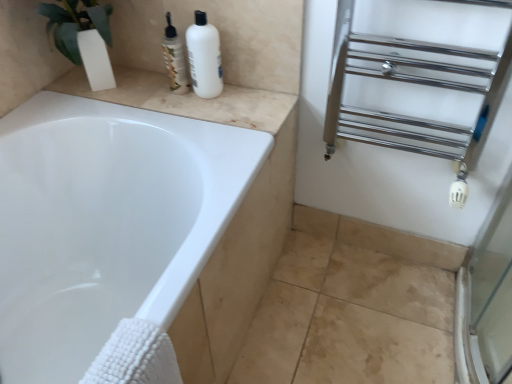
Question: Considering the relative positions of chrome/metal towel rack at right and beige marble counter top at upper left in the image provided, is chrome/metal towel rack at right behind beige marble counter top at upper left?

Choices:
 (A) yes
 (B) no

Answer: (B)

Question: Can we say chrome/metal towel rack at right lies outside beige marble counter top at upper left?

Choices:
 (A) no
 (B) yes

Answer: (B)

Question: From the image's perspective, is chrome/metal towel rack at right located above beige marble counter top at upper left?

Choices:
 (A) yes
 (B) no

Answer: (B)

Question: Considering the relative sizes of chrome/metal towel rack at right and beige marble counter top at upper left in the image provided, is chrome/metal towel rack at right shorter than beige marble counter top at upper left?

Choices:
 (A) yes
 (B) no

Answer: (B)

Question: Is chrome/metal towel rack at right in front of beige marble counter top at upper left?

Choices:
 (A) no
 (B) yes

Answer: (B)

Question: Can you confirm if chrome/metal towel rack at right is thinner than beige marble counter top at upper left?

Choices:
 (A) yes
 (B) no

Answer: (A)

Question: Is white matte bottle at upper center to the right of beige marble counter top at upper left from the viewer's perspective?

Choices:
 (A) no
 (B) yes

Answer: (B)

Question: From a real-world perspective, is white matte bottle at upper center below beige marble counter top at upper left?

Choices:
 (A) no
 (B) yes

Answer: (A)

Question: Does white matte bottle at upper center have a lesser width compared to beige marble counter top at upper left?

Choices:
 (A) no
 (B) yes

Answer: (B)

Question: From the image's perspective, is white matte bottle at upper center below beige marble counter top at upper left?

Choices:
 (A) no
 (B) yes

Answer: (A)

Question: Considering the relative sizes of white matte bottle at upper center and beige marble counter top at upper left in the image provided, is white matte bottle at upper center bigger than beige marble counter top at upper left?

Choices:
 (A) yes
 (B) no

Answer: (B)

Question: Could you tell me if white matte bottle at upper center is facing beige marble counter top at upper left?

Choices:
 (A) yes
 (B) no

Answer: (B)

Question: Considering the relative sizes of beige marble counter top at upper left and chrome/metal towel rack at right in the image provided, is beige marble counter top at upper left shorter than chrome/metal towel rack at right?

Choices:
 (A) yes
 (B) no

Answer: (A)